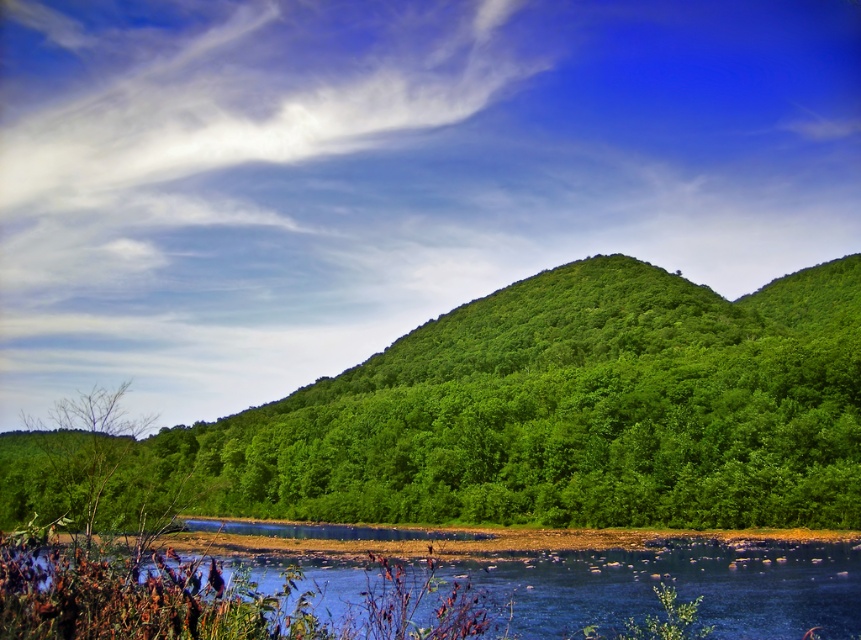
Question: Does blue water at lower center appear under green leafy tree at lower left?

Choices:
 (A) yes
 (B) no

Answer: (B)

Question: Estimate the real-world distances between objects in this image. Which object is closer to the green leafy tree at center?

Choices:
 (A) green leafy tree at lower left
 (B) blue water at lower center

Answer: (A)

Question: Is green leafy tree at center above green leafy tree at lower left?

Choices:
 (A) yes
 (B) no

Answer: (A)

Question: Which point is closer to the camera taking this photo?

Choices:
 (A) (100, 452)
 (B) (548, 269)
 (C) (682, 625)

Answer: (C)

Question: Estimate the real-world distances between objects in this image. Which object is farther from the blue water at lower center?

Choices:
 (A) green leafy tree at center
 (B) green leafy tree at lower left

Answer: (A)

Question: Observing the image, what is the correct spatial positioning of green leafy tree at center in reference to blue water at lower center?

Choices:
 (A) above
 (B) below

Answer: (A)